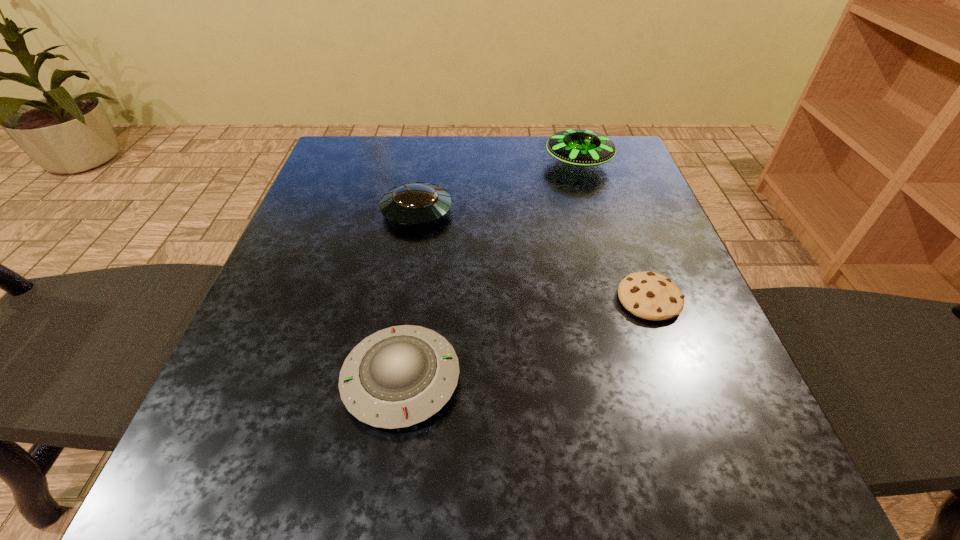
At what (x,y) coordinates should I click in order to perform the action: click on object located in the far edge section of the desktop. Please return your answer as a coordinate pair (x, y). This screenshot has width=960, height=540. Looking at the image, I should click on (582, 147).

The image size is (960, 540). I want to click on saucer that is at the right edge, so click(x=582, y=147).

What are the coordinates of `cookie present at the right edge` in the screenshot? It's located at (648, 295).

Identify the location of object at the far right corner. This screenshot has width=960, height=540. (582, 147).

Image resolution: width=960 pixels, height=540 pixels. In order to click on free space at the far edge of the desktop in this screenshot , I will do `click(406, 151)`.

This screenshot has width=960, height=540. In the image, there is a desktop. What are the coordinates of `vacant space at the near edge` in the screenshot? It's located at (424, 500).

Locate an element on the screen. vacant space at the left edge of the desktop is located at coordinates (281, 328).

In the image, there is a desktop. In order to click on vacant space at the right edge in this screenshot , I will do `click(631, 203)`.

The width and height of the screenshot is (960, 540). In the image, there is a desktop. What are the coordinates of `blank space at the far left corner` in the screenshot? It's located at (362, 170).

Where is `free region at the far right corner of the desktop`? This screenshot has width=960, height=540. free region at the far right corner of the desktop is located at coordinates (591, 174).